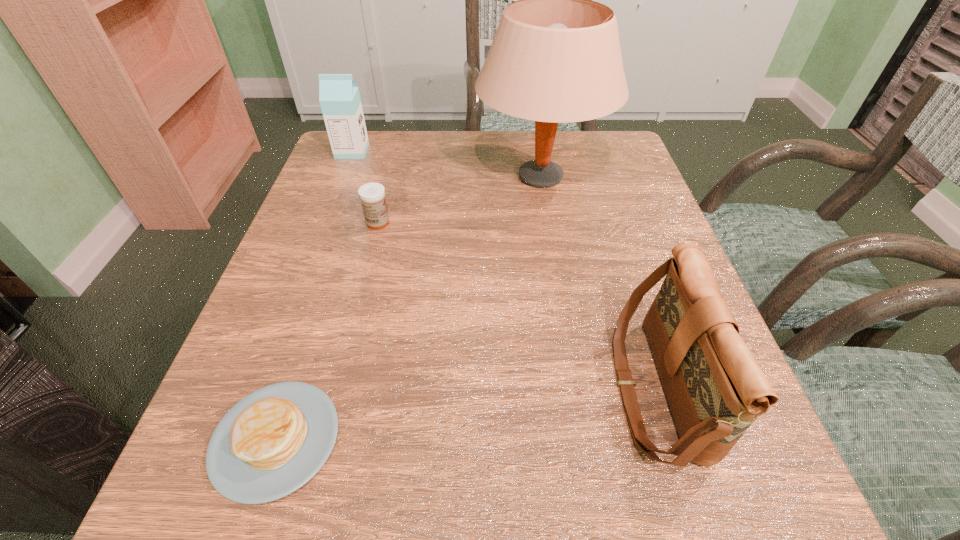
The height and width of the screenshot is (540, 960). I want to click on free space located on the front of the medicine, so click(353, 318).

Find the location of `free region located 0.110m on the right of the pancake`. free region located 0.110m on the right of the pancake is located at coordinates (419, 440).

This screenshot has height=540, width=960. I want to click on lampshade located at the far edge, so click(x=555, y=58).

Identify the location of milk carton that is at the far edge. This screenshot has width=960, height=540. (339, 97).

Identify the location of shoulder bag situated at the near edge. (715, 388).

This screenshot has height=540, width=960. I want to click on pancake present at the near edge, so click(x=272, y=442).

At what (x,y) coordinates should I click in order to perform the action: click on milk carton present at the left edge. Please return your answer as a coordinate pair (x, y). Looking at the image, I should click on (339, 97).

At what (x,y) coordinates should I click in order to perform the action: click on medicine present at the left edge. Please return your answer as a coordinate pair (x, y). The image size is (960, 540). Looking at the image, I should click on (372, 195).

Identify the location of pancake situated at the left edge. Image resolution: width=960 pixels, height=540 pixels. (272, 442).

I want to click on lampshade at the right edge, so click(x=555, y=58).